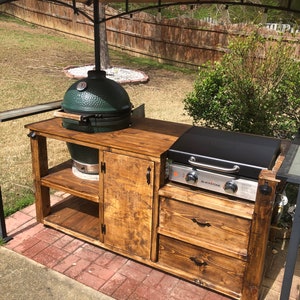
Find the location of a particular element. The height and width of the screenshot is (300, 300). brick flooring is located at coordinates pos(98,265).